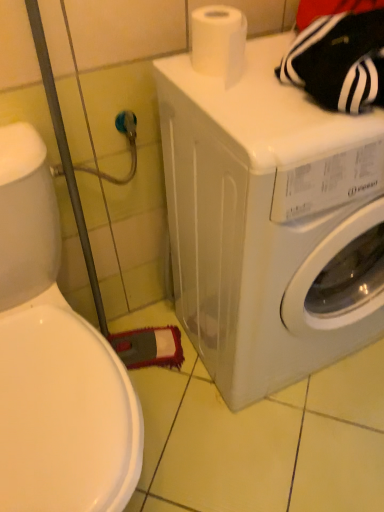
You are a GUI agent. You are given a task and a screenshot of the screen. Output one action in this format:
    pyautogui.click(x=<x>, y=<y>)
    Task: Click on the free point in front of white matte toilet paper at upper center
    This screenshot has width=384, height=512.
    Given the screenshot: What is the action you would take?
    pyautogui.click(x=257, y=114)